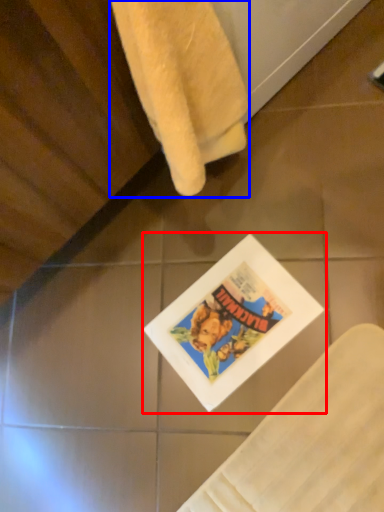
Question: Which point is closer to the camera, comic book (highlighted by a red box) or towel (highlighted by a blue box)?

Choices:
 (A) comic book
 (B) towel

Answer: (B)